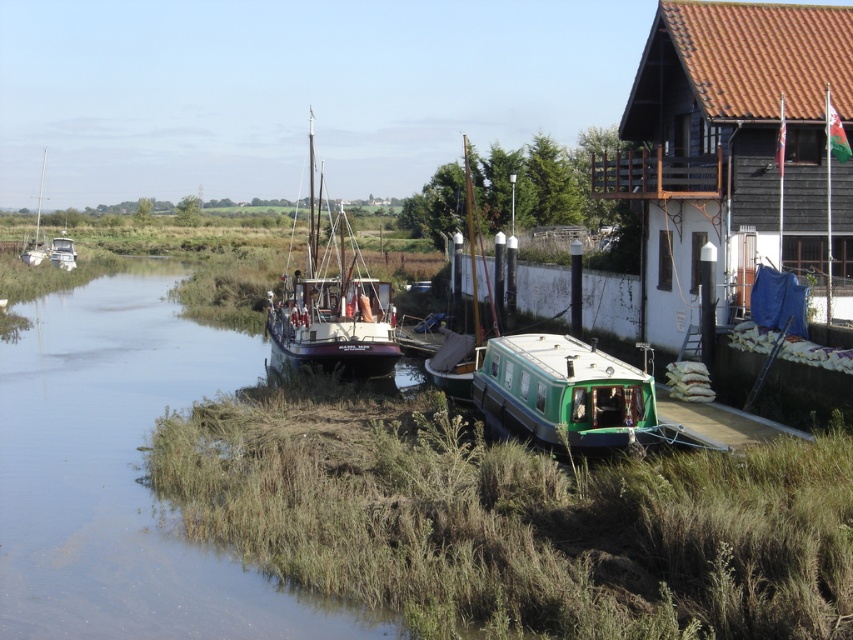
Question: Which of the following is the farthest from the observer?

Choices:
 (A) (64, 252)
 (B) (476, 356)

Answer: (A)

Question: Which point is closer to the camera?

Choices:
 (A) (473, 321)
 (B) (293, 305)
 (C) (44, 257)

Answer: (B)

Question: Is brown wooden hut at upper right below wooden sailboat at center?

Choices:
 (A) yes
 (B) no

Answer: (A)

Question: Does brown wooden hut at upper right come in front of green matte boat at lower center?

Choices:
 (A) no
 (B) yes

Answer: (A)

Question: Is brown wooden hut at upper right below white wooden sailboat at left?

Choices:
 (A) no
 (B) yes

Answer: (B)

Question: Which point appears closest to the camera in this image?

Choices:
 (A) (479, 321)
 (B) (518, 433)
 (C) (38, 218)

Answer: (B)